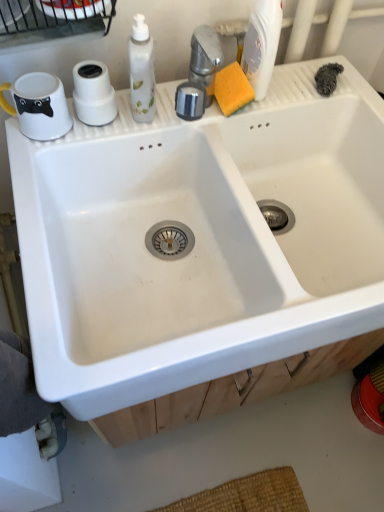
Find the location of `free space above wooden drawer at lower center (from a real-world perspective)`. free space above wooden drawer at lower center (from a real-world perspective) is located at coordinates (242, 459).